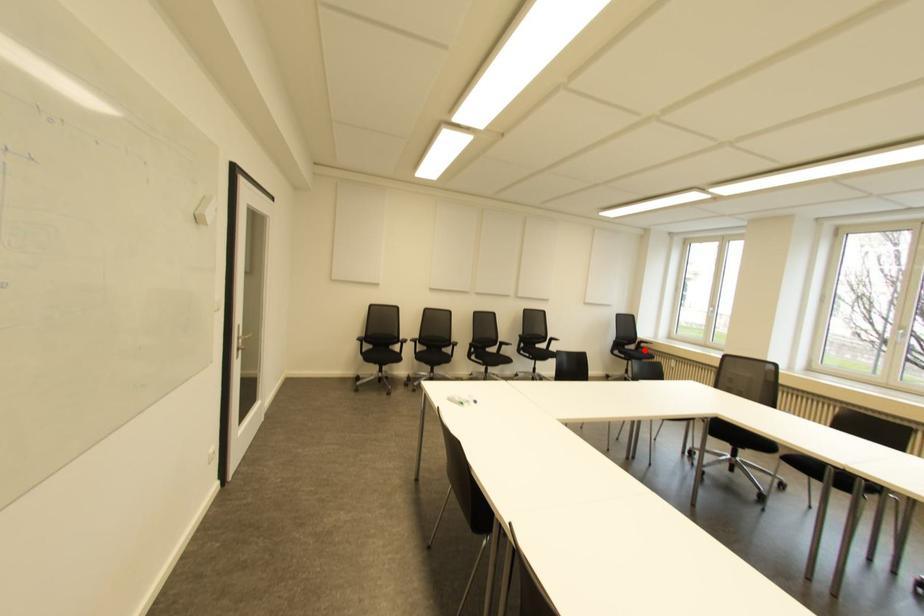
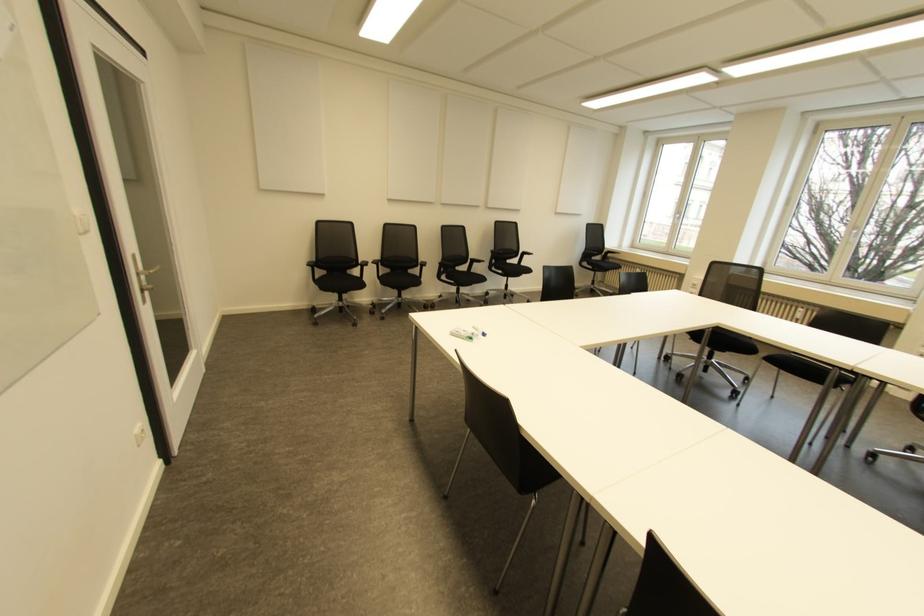
Question: I am providing you with two images of the same scene from different viewpoints. Image1 has a red point marked. In image2, the corresponding 3D location appears at what relative position? Reply with the corresponding letter.

Choices:
 (A) Closer
 (B) Farther

Answer: (A)